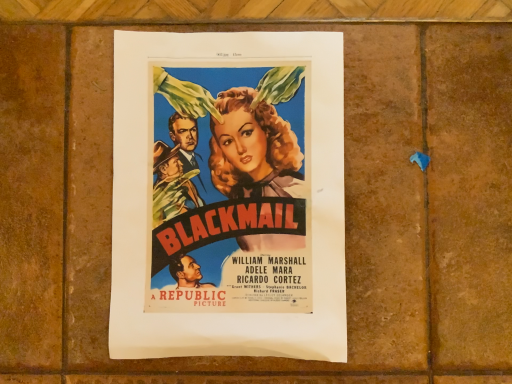
This screenshot has height=384, width=512. I want to click on matte paper poster at center, so click(228, 195).

What do you see at coordinates (228, 195) in the screenshot? This screenshot has height=384, width=512. I see `matte paper poster at center` at bounding box center [228, 195].

Identify the location of matte paper poster at center. (228, 195).